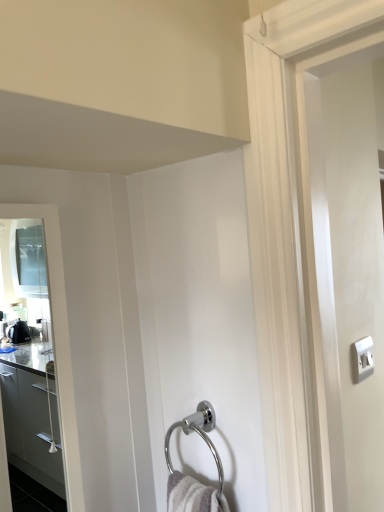
In order to click on chrome metallic towel ring at lower center in this screenshot , I will do `click(198, 434)`.

Image resolution: width=384 pixels, height=512 pixels. What do you see at coordinates (198, 434) in the screenshot? I see `chrome metallic towel ring at lower center` at bounding box center [198, 434].

The width and height of the screenshot is (384, 512). I want to click on chrome metallic towel ring at lower center, so click(x=198, y=434).